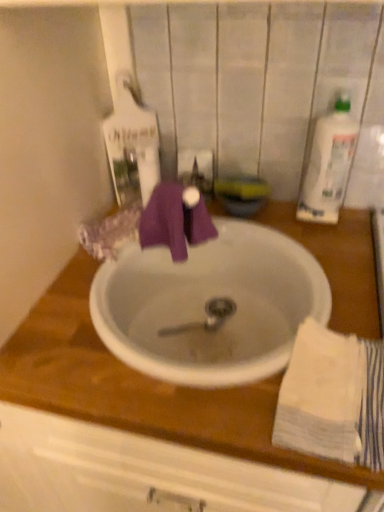
Identify the location of free space that is in between white cotton towel at lower right and white plastic bottle at upper right. The width and height of the screenshot is (384, 512). (336, 278).